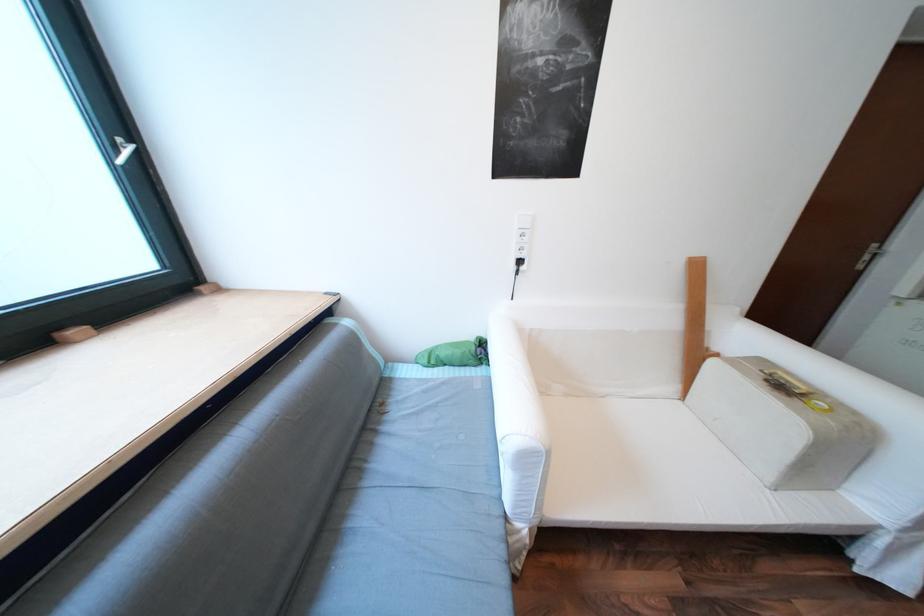
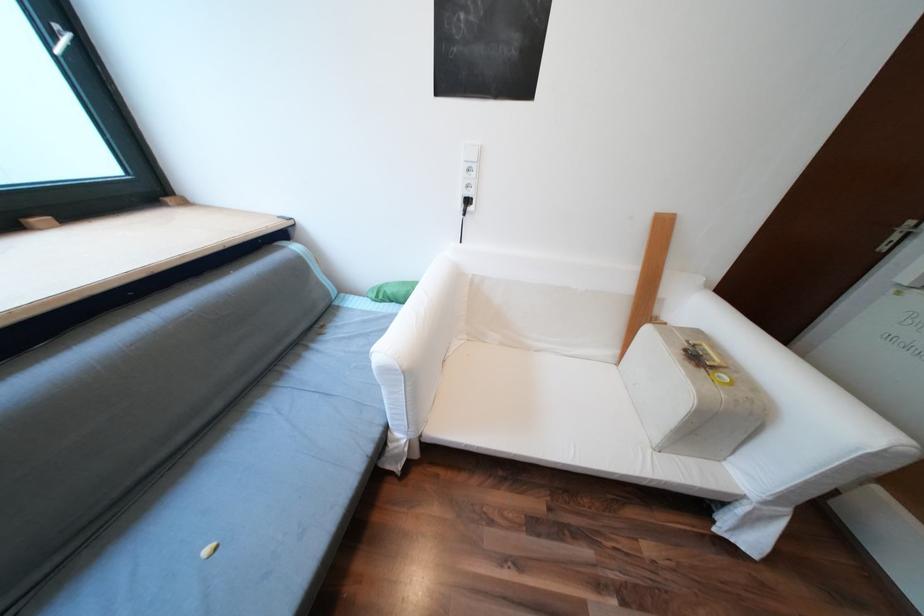
In the second image, find the point that corresponds to point (127, 148) in the first image.

(65, 37)